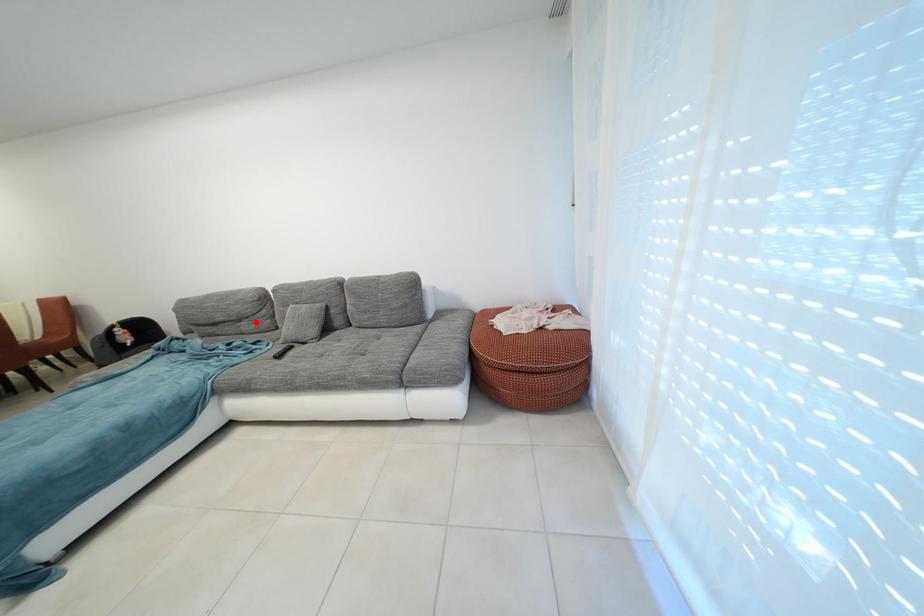
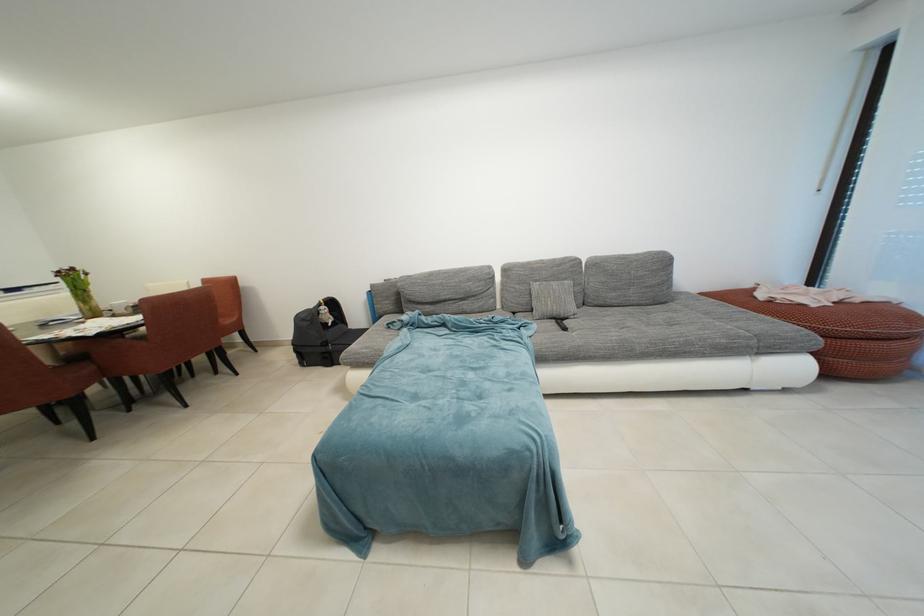
In the second image, find the point that corresponds to the highlighted location in the first image.

(482, 301)